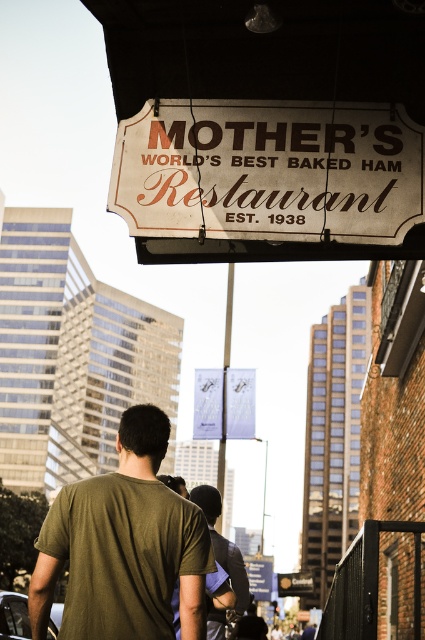
Is white painted wood sign at upper center smaller than wooden signboard at upper center?

Yes.

Can you confirm if white painted wood sign at upper center is taller than wooden signboard at upper center?

In fact, white painted wood sign at upper center may be shorter than wooden signboard at upper center.

What do you see at coordinates (268, 172) in the screenshot? Image resolution: width=425 pixels, height=640 pixels. I see `white painted wood sign at upper center` at bounding box center [268, 172].

The width and height of the screenshot is (425, 640). I want to click on white painted wood sign at upper center, so click(268, 172).

Who is taller, white painted wood sign at upper center or green cotton t-shirt at center?

With more height is green cotton t-shirt at center.

Does white painted wood sign at upper center appear on the left side of green cotton t-shirt at center?

No, white painted wood sign at upper center is not to the left of green cotton t-shirt at center.

Where is `white painted wood sign at upper center`? This screenshot has width=425, height=640. white painted wood sign at upper center is located at coordinates (268, 172).

What are the coordinates of `white painted wood sign at upper center` in the screenshot? It's located at (268, 172).

Does white paper sign at center have a lesser height compared to wooden signboard at upper center?

Indeed, white paper sign at center has a lesser height compared to wooden signboard at upper center.

Where is `white paper sign at center`? This screenshot has width=425, height=640. white paper sign at center is located at coordinates (207, 403).

Which is in front, point (240, 378) or point (255, 576)?

Point (240, 378) is in front.

You are a GUI agent. You are given a task and a screenshot of the screen. Output one action in this format:
    pyautogui.click(x=<x>, y=<y>)
    Task: Click on the white paper sign at center
    
    Given the screenshot: What is the action you would take?
    click(x=207, y=403)